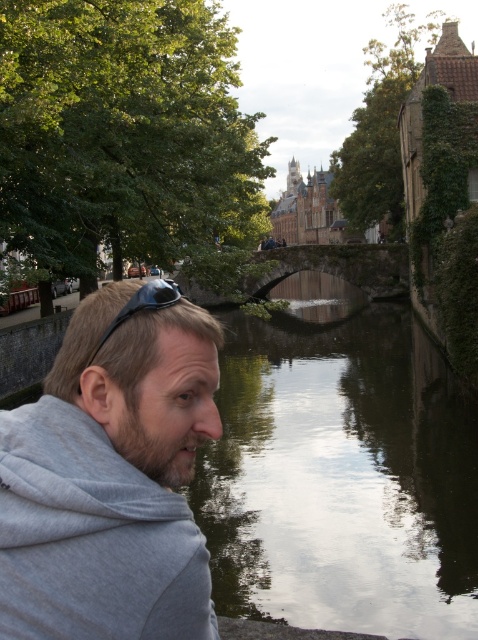
You are a tourist standing on the stone bridge and want to take a photo of the gray cotton hoodie at left and the greenish concrete canal at center. Which object should you focus on first if you want both to be in sharp focus?

You should focus on the gray cotton hoodie at left first because it is closer to you than the greenish concrete canal at center, so focusing on the closer object ensures both will be in focus.

You are standing in the scene and want to walk from the gray cotton hoodie at left to the greenish concrete canal at center. Which direction should you head?

You should head to the right to reach the greenish concrete canal at center from the gray cotton hoodie at left.